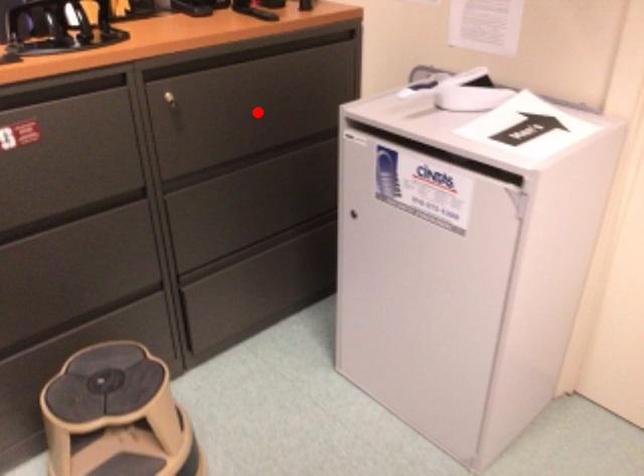
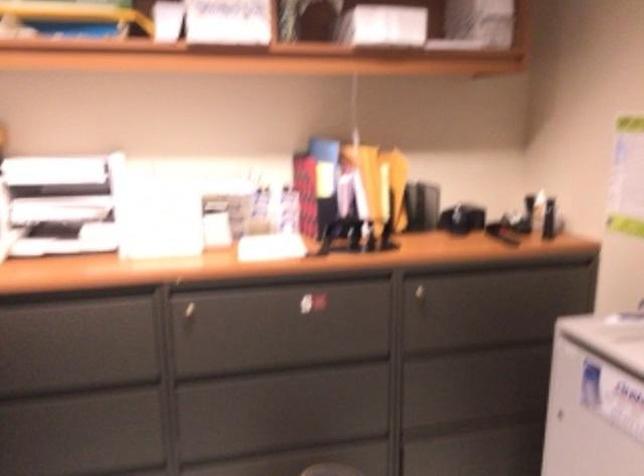
Locate, in the second image, the point that corresponds to the highlighted location in the first image.

(489, 311)